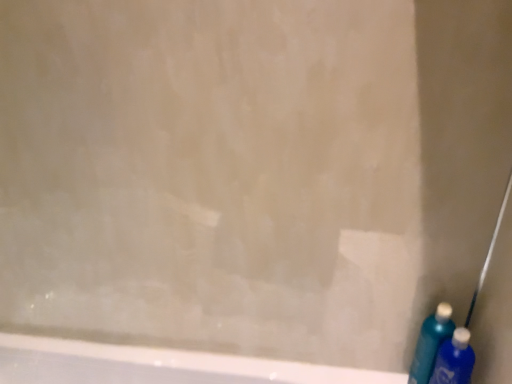
Question: From a real-world perspective, is blue plastic bottle at lower right, marked as the second cleaning product in a back-to-front arrangement, physically located above or below blue glossy bottle at lower right, arranged as the second cleaning product when viewed from the front?

Choices:
 (A) below
 (B) above

Answer: (A)

Question: Is blue plastic bottle at lower right, acting as the first cleaning product starting from the front, wider or thinner than blue glossy bottle at lower right, arranged as the second cleaning product when viewed from the front?

Choices:
 (A) wide
 (B) thin

Answer: (A)

Question: Is blue plastic bottle at lower right, acting as the first cleaning product starting from the front, to the left or to the right of blue glossy bottle at lower right, the first cleaning product in the back-to-front sequence, in the image?

Choices:
 (A) right
 (B) left

Answer: (A)

Question: Based on their positions, is blue glossy bottle at lower right, the first cleaning product in the back-to-front sequence, located to the left or right of blue plastic bottle at lower right, acting as the first cleaning product starting from the front?

Choices:
 (A) right
 (B) left

Answer: (B)

Question: From the image's perspective, is blue glossy bottle at lower right, arranged as the second cleaning product when viewed from the front, positioned above or below blue plastic bottle at lower right, acting as the first cleaning product starting from the front?

Choices:
 (A) above
 (B) below

Answer: (A)

Question: Considering their positions, is blue glossy bottle at lower right, the first cleaning product in the back-to-front sequence, located in front of or behind blue plastic bottle at lower right, acting as the first cleaning product starting from the front?

Choices:
 (A) front
 (B) behind

Answer: (B)

Question: From their relative heights in the image, would you say blue glossy bottle at lower right, arranged as the second cleaning product when viewed from the front, is taller or shorter than blue plastic bottle at lower right, marked as the second cleaning product in a back-to-front arrangement?

Choices:
 (A) short
 (B) tall

Answer: (B)